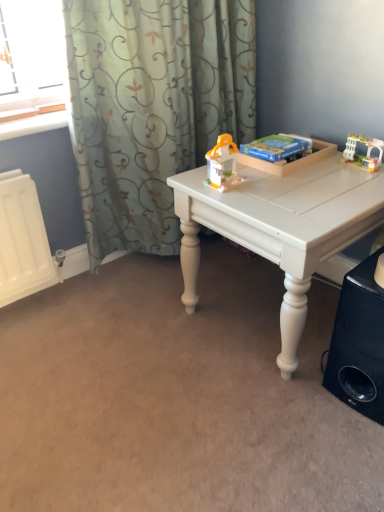
You are a GUI agent. You are given a task and a screenshot of the screen. Output one action in this format:
    pyautogui.click(x=<x>, y=<y>)
    Task: Click on the free space to the left of black matte speaker at lower right
    The image size is (384, 512).
    Given the screenshot: What is the action you would take?
    pyautogui.click(x=286, y=387)